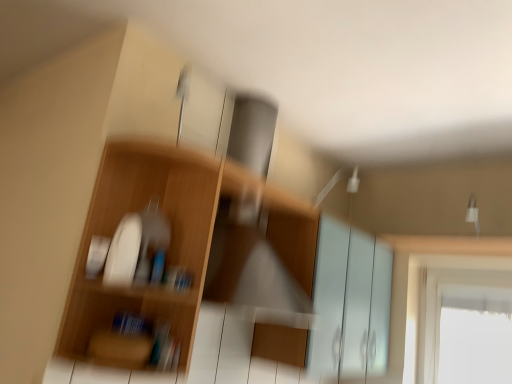
Question: Does wooden shelf at left have a greater width compared to white glossy screen door at center?

Choices:
 (A) no
 (B) yes

Answer: (A)

Question: Is wooden shelf at left not within white glossy screen door at center?

Choices:
 (A) yes
 (B) no

Answer: (A)

Question: Is wooden shelf at left positioned in front of white glossy screen door at center?

Choices:
 (A) no
 (B) yes

Answer: (B)

Question: Is wooden shelf at left smaller than white glossy screen door at center?

Choices:
 (A) no
 (B) yes

Answer: (B)

Question: From the image's perspective, is wooden shelf at left under white glossy screen door at center?

Choices:
 (A) no
 (B) yes

Answer: (A)

Question: Would you consider wooden shelf at left to be distant from white glossy screen door at center?

Choices:
 (A) no
 (B) yes

Answer: (A)

Question: From the image's perspective, is white glossy screen door at center on wooden shelf at left?

Choices:
 (A) no
 (B) yes

Answer: (A)

Question: Does white glossy screen door at center have a greater width compared to wooden shelf at left?

Choices:
 (A) no
 (B) yes

Answer: (B)

Question: Is white glossy screen door at center not close to wooden shelf at left?

Choices:
 (A) no
 (B) yes

Answer: (A)

Question: Is white glossy screen door at center placed right next to wooden shelf at left?

Choices:
 (A) no
 (B) yes

Answer: (A)

Question: From the image's perspective, is white glossy screen door at center located beneath wooden shelf at left?

Choices:
 (A) yes
 (B) no

Answer: (A)

Question: Can you confirm if white glossy screen door at center is bigger than wooden shelf at left?

Choices:
 (A) no
 (B) yes

Answer: (B)

Question: Is point coord(389,302) closer or farther from the camera than point coord(143,158)?

Choices:
 (A) farther
 (B) closer

Answer: (A)